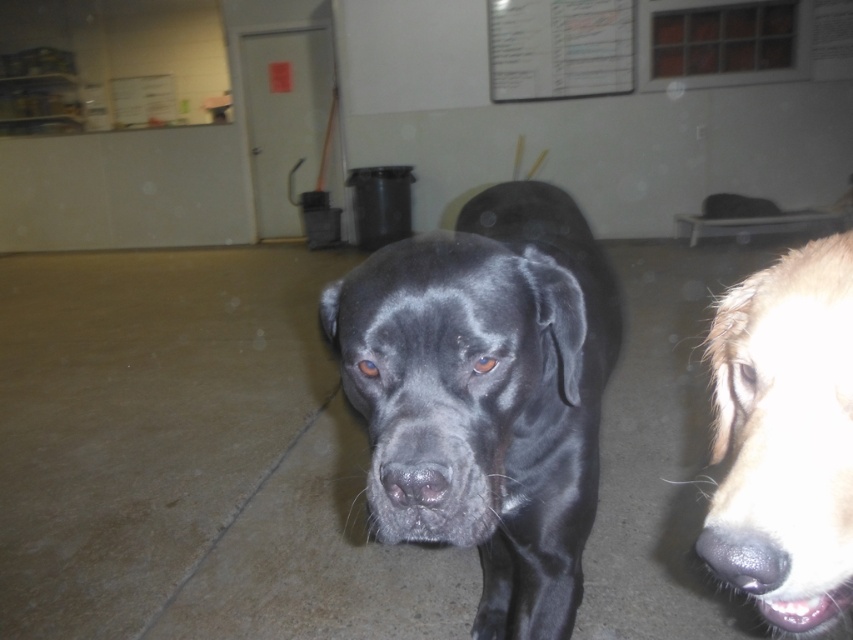
You are a photographer trying to capture the golden fur at center in the best lighting possible. You notice a point at coordinates (785, 436). Where is this point located relative to the golden fur?

The point at coordinates (785, 436) corresponds to the shiny golden fur at center, so it is located directly on the golden fur.

You are a photographer setting up a shoot in an indoor dog shelter. You notice the shiny golden fur at center and the white paper at upper center. Where should you place your camera to ensure both objects are in frame?

You should position your camera below the shiny golden fur at center and the white paper at upper center since the shiny golden fur at center is under the white paper at upper center, meaning they are vertically aligned.

You are a photographer trying to capture a clear shot of the shiny black dog at center and the white paper at upper center. Based on their positions, which object is closer to the camera?

The shiny black dog at center is closer to the camera than the white paper at upper center because it is in front of it.